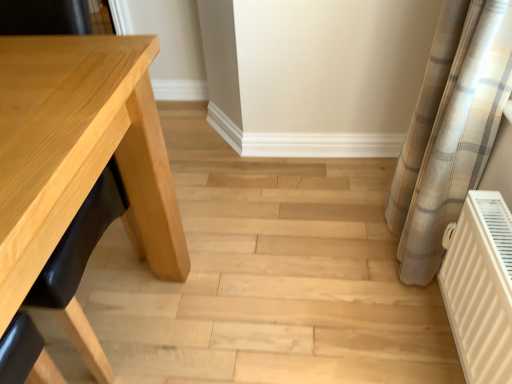
The width and height of the screenshot is (512, 384). What are the coordinates of `vacant area located to the right-hand side of light wood table at left` in the screenshot? It's located at (226, 287).